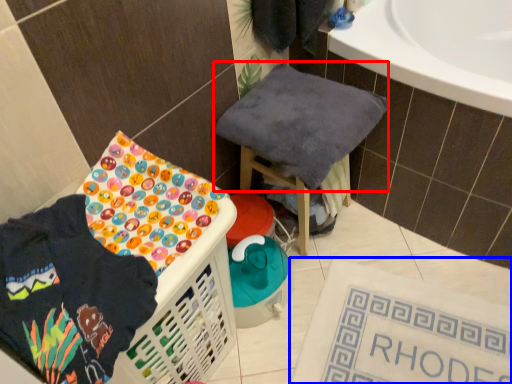
Question: Which of the following is the closest to the observer, baby clothe (highlighted by a red box) or bath mat (highlighted by a blue box)?

Choices:
 (A) baby clothe
 (B) bath mat

Answer: (A)